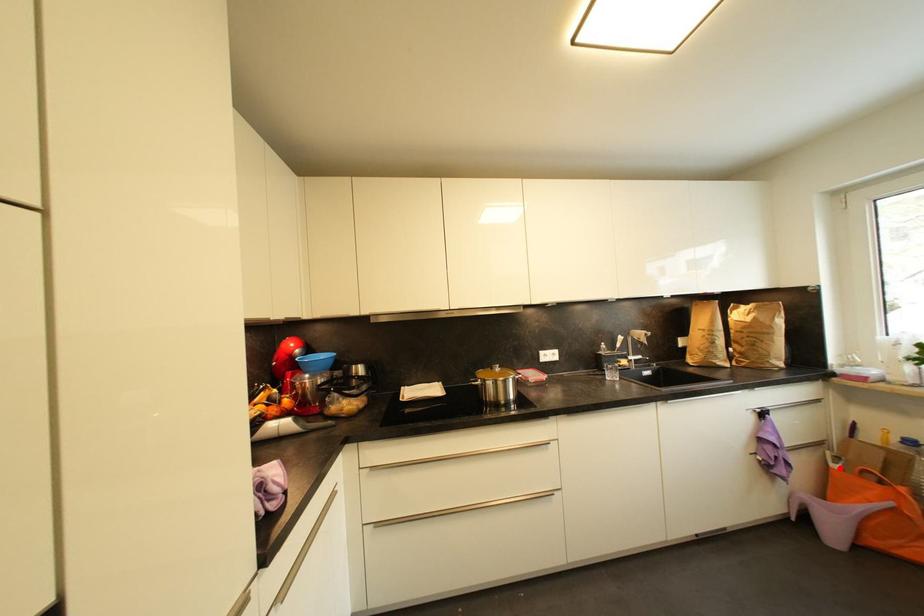
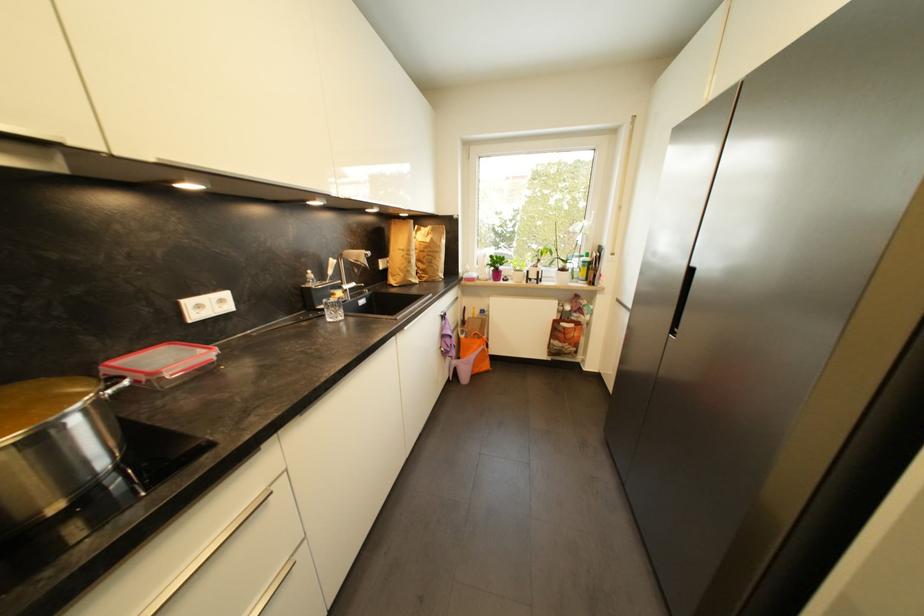
The point at the highlighted location is marked in the first image. Where is the corresponding point in the second image?

(468, 339)